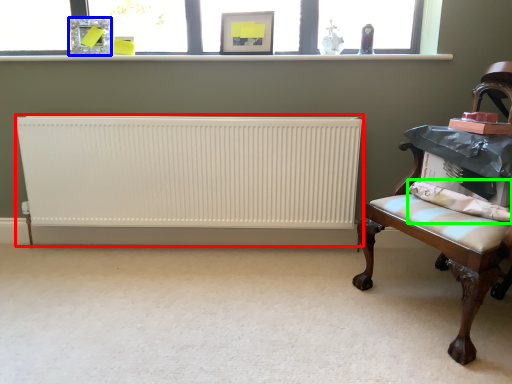
Question: Which object is positioned closest to radiator (highlighted by a red box)? Select from picture frame (highlighted by a blue box) and pillow (highlighted by a green box).

Choices:
 (A) picture frame
 (B) pillow

Answer: (A)